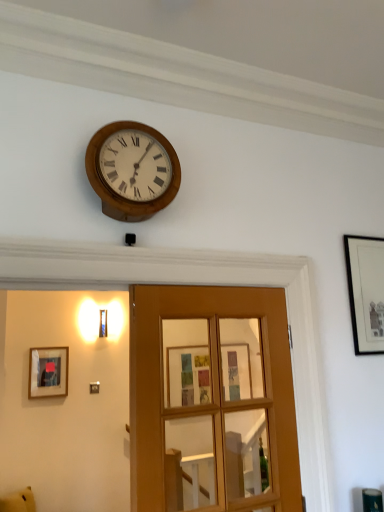
Question: From a real-world perspective, is black matte picture frame at upper right, the first picture frame from the top, above or below wooden clock at upper center?

Choices:
 (A) below
 (B) above

Answer: (A)

Question: Would you say black matte picture frame at upper right, which is the first picture frame from front to back, is to the left or to the right of wooden clock at upper center in the picture?

Choices:
 (A) right
 (B) left

Answer: (A)

Question: Based on their relative distances, which object is farther from the matte black picture frame at left, which is the first picture frame from back to front?

Choices:
 (A) wooden clock at upper center
 (B) black matte picture frame at upper right, which is the first picture frame from front to back
 (C) wooden glass door at center
 (D) yellow plush toy at lower left

Answer: (B)

Question: Which object is positioned closest to the yellow plush toy at lower left?

Choices:
 (A) matte black picture frame at left, which is the 2th picture frame from right to left
 (B) wooden glass door at center
 (C) wooden clock at upper center
 (D) black matte picture frame at upper right, which is counted as the 1th picture frame, starting from the right

Answer: (A)